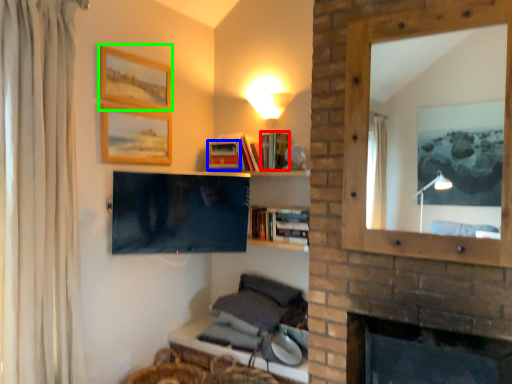
Question: Which is farther away from book (highlighted by a red box)? book (highlighted by a blue box) or picture frame (highlighted by a green box)?

Choices:
 (A) book
 (B) picture frame

Answer: (B)